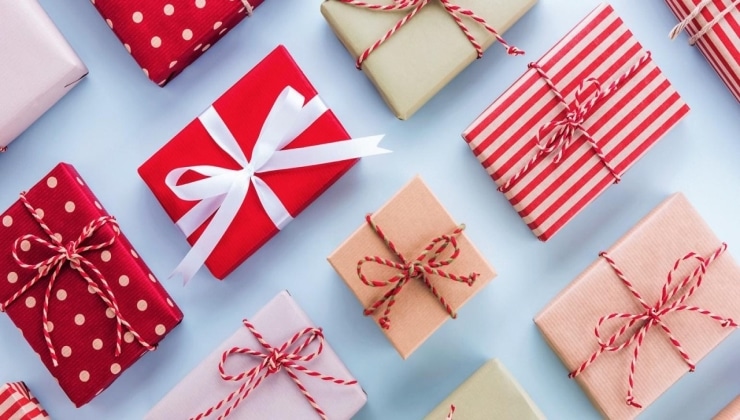
Locate an element on the screen. boxes with red and white strapped string tied around them is located at coordinates [283, 367], [64, 253], [411, 269], [645, 300], [570, 118], [417, 7], [4, 148], [453, 408].